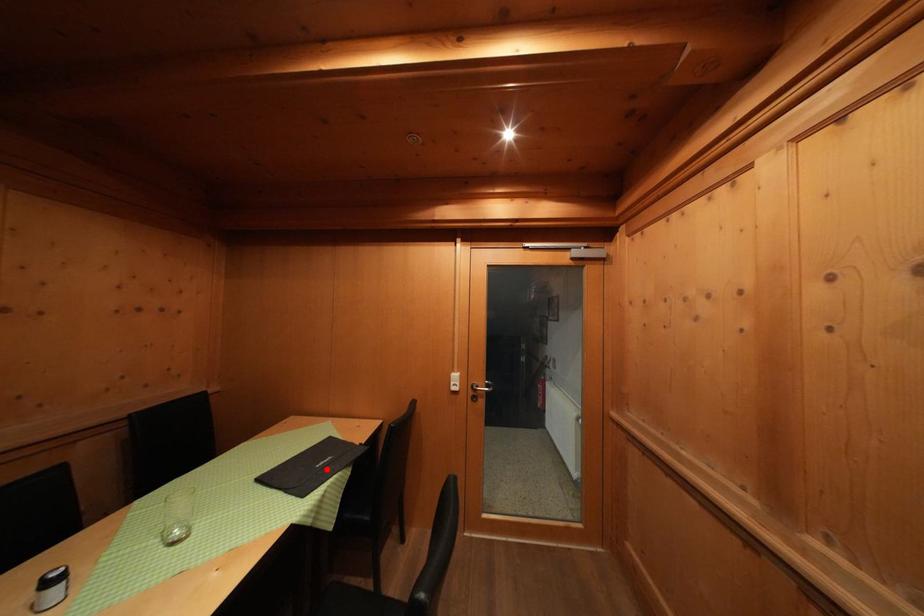
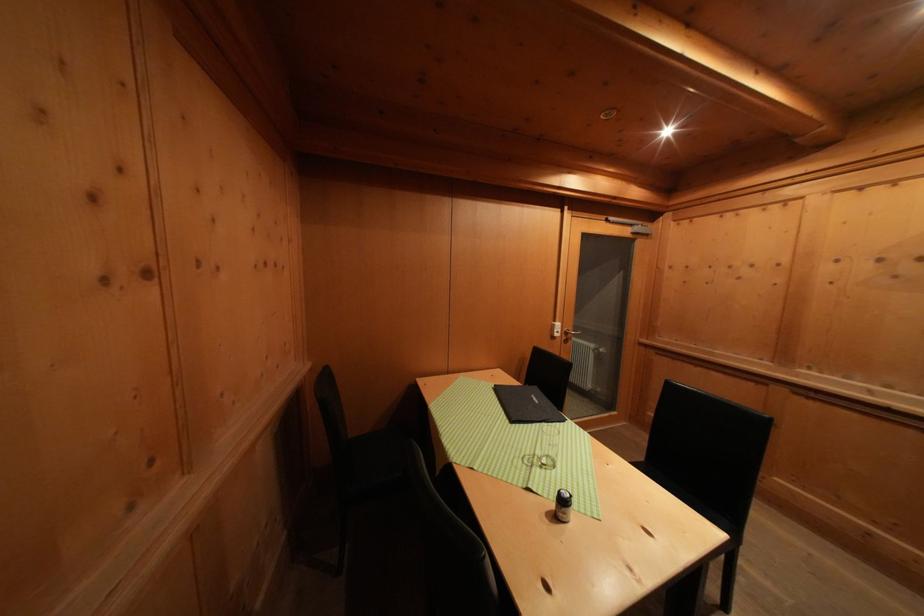
Where in the second image is the point corresponding to the highlighted location from the first image?

(542, 406)